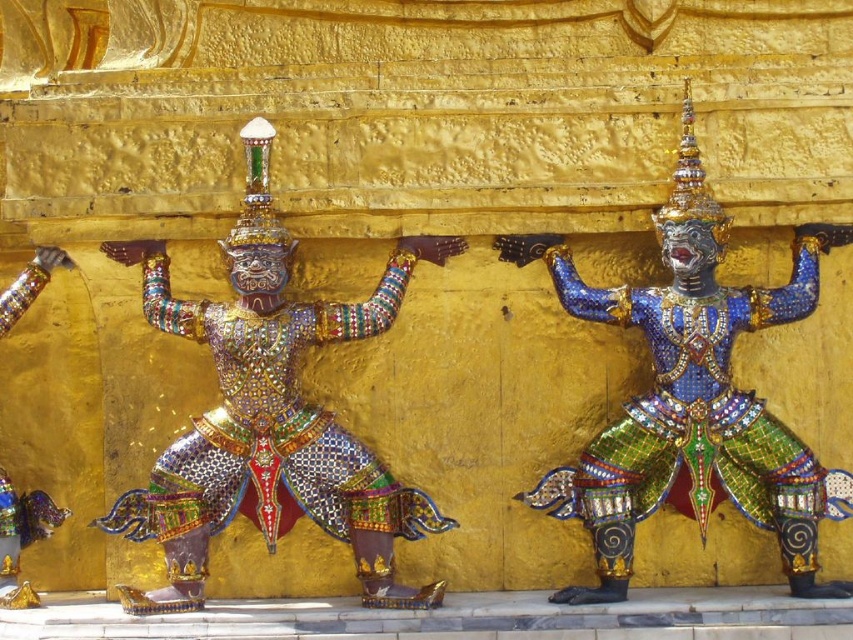
Question: Can you confirm if multicolored mosaic deity at center is positioned to the right of blue mosaic statue at center?

Choices:
 (A) no
 (B) yes

Answer: (A)

Question: Is multicolored mosaic deity at center wider than blue mosaic statue at center?

Choices:
 (A) no
 (B) yes

Answer: (B)

Question: Is multicolored mosaic deity at center behind shiny gold armor at left?

Choices:
 (A) yes
 (B) no

Answer: (B)

Question: Which object is the closest to the multicolored mosaic deity at center?

Choices:
 (A) shiny gold armor at left
 (B) blue mosaic statue at center

Answer: (B)

Question: Which of these objects is positioned farthest from the multicolored mosaic deity at center?

Choices:
 (A) shiny gold armor at left
 (B) blue mosaic statue at center

Answer: (A)

Question: Among these points, which one is nearest to the camera?

Choices:
 (A) (815, 529)
 (B) (270, 209)
 (C) (0, 570)

Answer: (B)